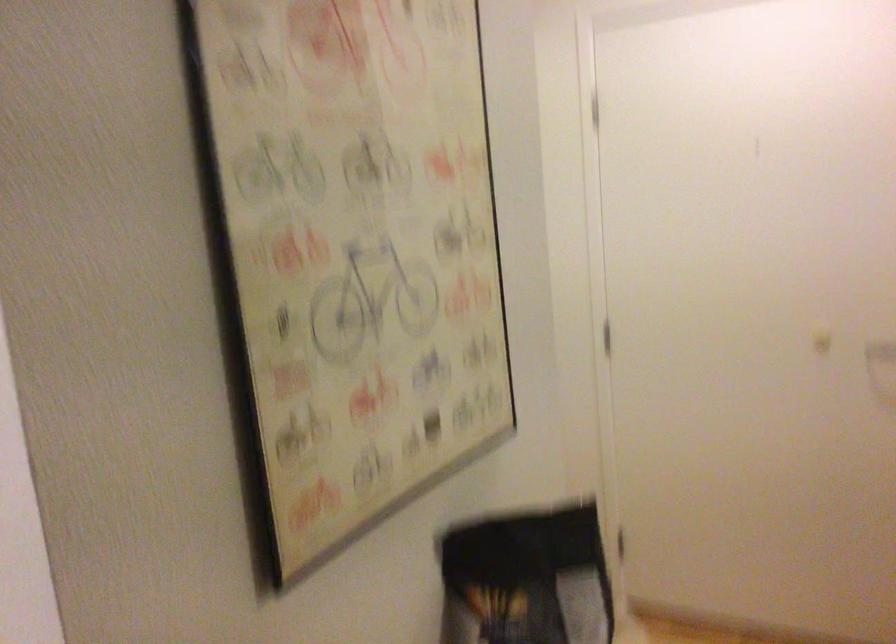
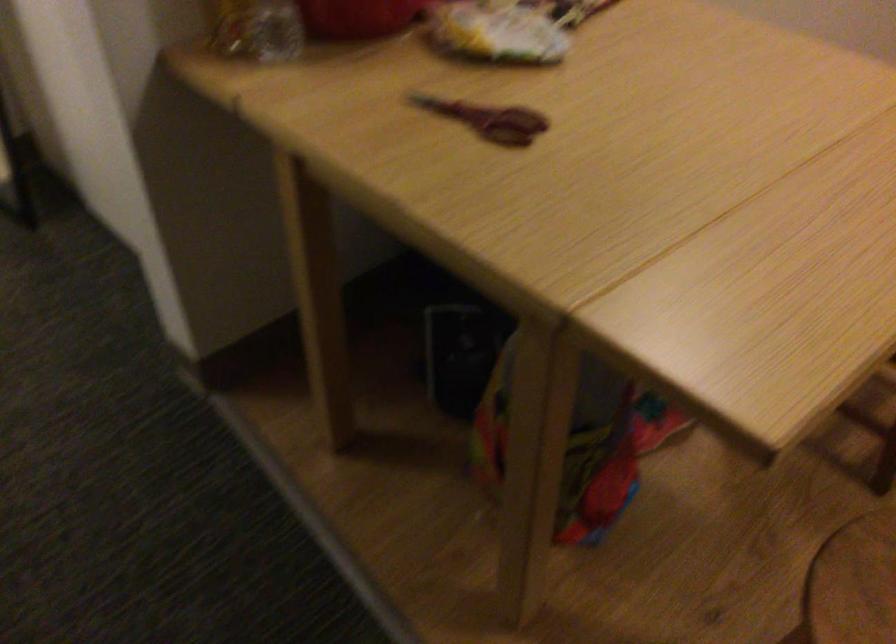
Question: Based on the continuous images, in which direction is the camera rotating? Reply with the corresponding letter.

Choices:
 (A) Left
 (B) Right
 (C) Up
 (D) Down

Answer: (D)